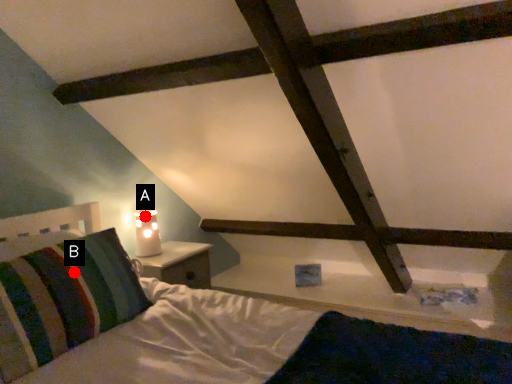
Question: Two points are circled on the image, labeled by A and B beside each circle. Which point appears closest to the camera in this image?

Choices:
 (A) A is closer
 (B) B is closer

Answer: (B)